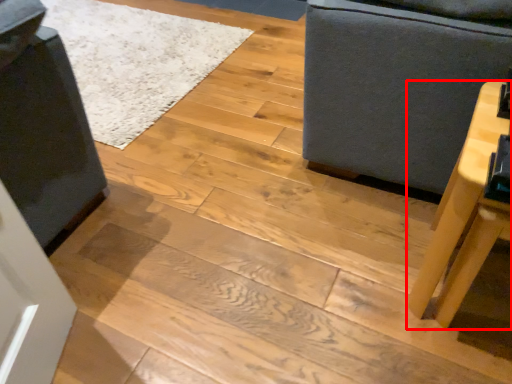
Question: From the image, what is the correct spatial relationship of table (annotated by the red box) in relation to furniture?

Choices:
 (A) left
 (B) right

Answer: (A)